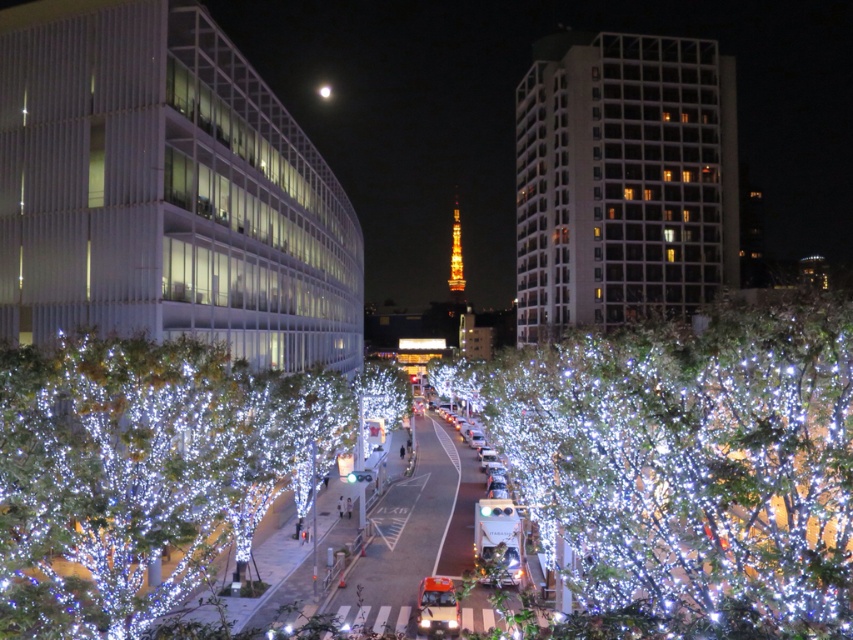
Question: Is illuminated plastic tree at center below illuminated plastic trees at center?

Choices:
 (A) yes
 (B) no

Answer: (B)

Question: Which of the following is the closest to the observer?

Choices:
 (A) (598, 461)
 (B) (148, 384)

Answer: (B)

Question: Is illuminated plastic tree at center positioned before illuminated plastic trees at center?

Choices:
 (A) no
 (B) yes

Answer: (B)

Question: Does illuminated plastic tree at center have a smaller size compared to illuminated plastic trees at center?

Choices:
 (A) no
 (B) yes

Answer: (A)

Question: Which point is farther to the camera?

Choices:
 (A) illuminated plastic trees at center
 (B) illuminated plastic tree at center

Answer: (A)